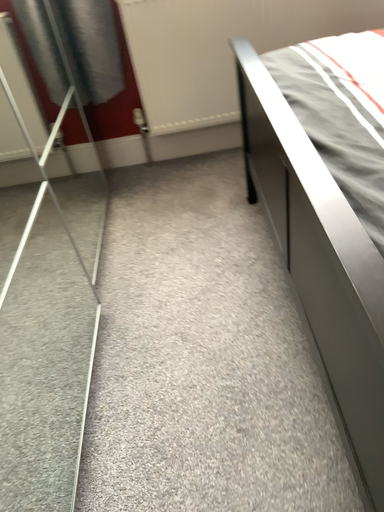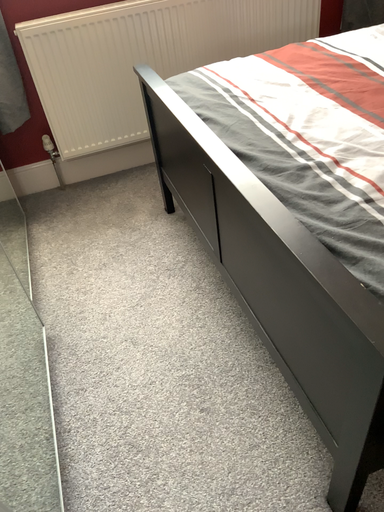
Question: Which way did the camera rotate in the video?

Choices:
 (A) rotated left
 (B) rotated right

Answer: (B)